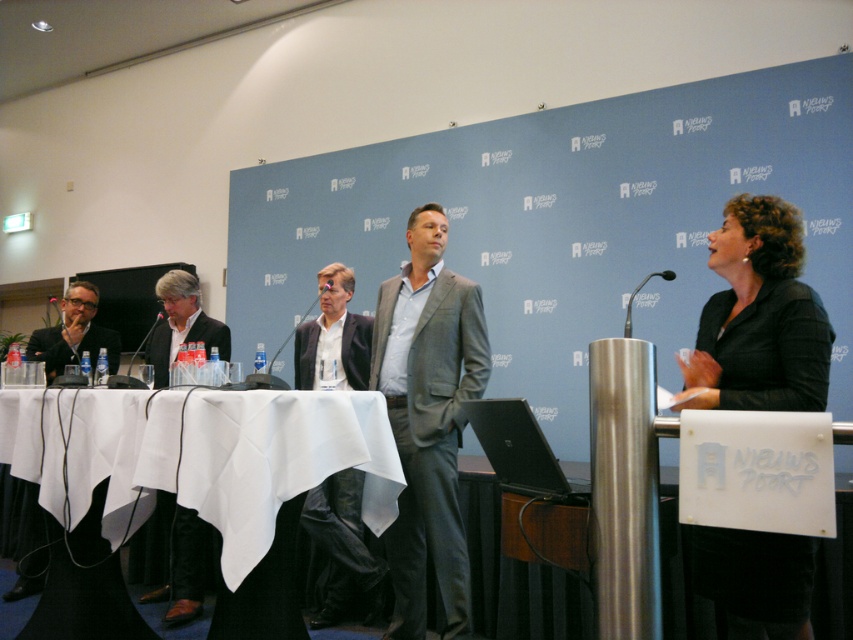
Question: Does black textured blazer at right have a larger size compared to gray textured suit at center?

Choices:
 (A) no
 (B) yes

Answer: (A)

Question: Can you confirm if gray textured suit at center is positioned above dark gray fabric business suit at left?

Choices:
 (A) yes
 (B) no

Answer: (B)

Question: Which is farther from the wooden table at center?

Choices:
 (A) white cloth-covered table at center
 (B) black textured blazer at right
 (C) black plastic microphone at left
 (D) dark gray fabric business suit at left

Answer: (C)

Question: Which of the following is the farthest from the observer?

Choices:
 (A) white cloth-covered table at center
 (B) gray textured suit at center
 (C) dark gray fabric business suit at center

Answer: (C)

Question: Is gray textured suit at center closer to camera compared to wooden table at center?

Choices:
 (A) yes
 (B) no

Answer: (A)

Question: Estimate the real-world distances between objects in this image. Which object is farther from the matte black microphone at center?

Choices:
 (A) metallic silver microphone at center
 (B) gray textured suit at center

Answer: (A)